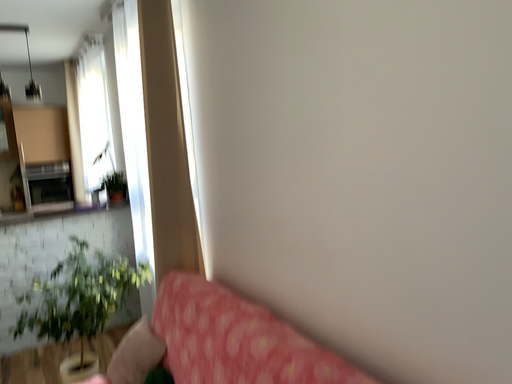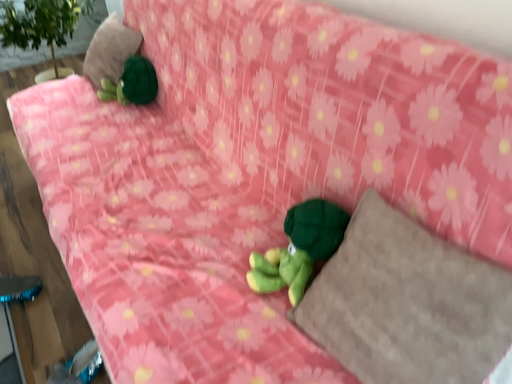
Question: Which way did the camera rotate in the video?

Choices:
 (A) rotated downward
 (B) rotated upward

Answer: (A)